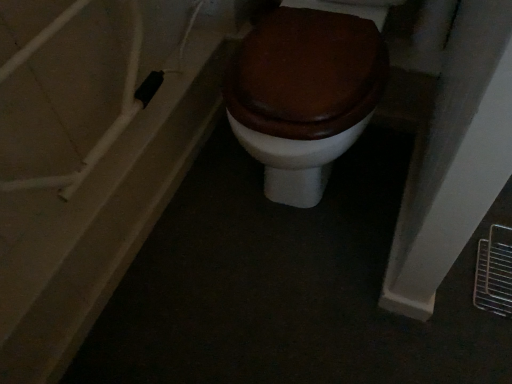
Identify the location of matte brown wood toilet at center. (304, 95).

What is the approximate width of matte brown wood toilet at center?

matte brown wood toilet at center is 73.54 centimeters in width.

The width and height of the screenshot is (512, 384). What do you see at coordinates (304, 95) in the screenshot?
I see `matte brown wood toilet at center` at bounding box center [304, 95].

In order to face matte brown wood toilet at center, should I rotate leftwards or rightwards?

It's best to rotate right around 7.763 degrees.

Find the location of a particular element. The width and height of the screenshot is (512, 384). matte white door at left is located at coordinates (92, 154).

The height and width of the screenshot is (384, 512). Describe the element at coordinates (92, 154) in the screenshot. I see `matte white door at left` at that location.

Find the location of a particular element. The image size is (512, 384). matte brown wood toilet at center is located at coordinates (304, 95).

Considering the positions of objects matte white door at left and matte brown wood toilet at center in the image provided, who is more to the right, matte white door at left or matte brown wood toilet at center?

matte brown wood toilet at center.

Which object is closer to the camera taking this photo, matte white door at left or matte brown wood toilet at center?

matte brown wood toilet at center is more forward.

Which point is more forward, [133,201] or [252,98]?

The point [252,98] is in front.

From the image's perspective, between matte white door at left and matte brown wood toilet at center, which one is located above?

matte brown wood toilet at center, from the image's perspective.

From a real-world perspective, is matte white door at left positioned under matte brown wood toilet at center based on gravity?

Yes, from a real-world perspective, matte white door at left is beneath matte brown wood toilet at center.

Can you confirm if matte white door at left is thinner than matte brown wood toilet at center?

No, matte white door at left is not thinner than matte brown wood toilet at center.

Is matte white door at left taller than matte brown wood toilet at center?

In fact, matte white door at left may be shorter than matte brown wood toilet at center.

Which of these two, matte white door at left or matte brown wood toilet at center, is smaller?

matte white door at left.

Is matte white door at left surrounding matte brown wood toilet at center?

Definitely not — matte brown wood toilet at center is not inside matte white door at left.

Are matte white door at left and matte brown wood toilet at center located far from each other?

No.

Is matte white door at left facing away from matte brown wood toilet at center?

That's not correct — matte white door at left is not looking away from matte brown wood toilet at center.

Can you tell me how much matte white door at left and matte brown wood toilet at center differ in facing direction?

The angular difference between matte white door at left and matte brown wood toilet at center is 180 degrees.

Image resolution: width=512 pixels, height=384 pixels. What are the coordinates of `toilet in front of the matte white door at left` in the screenshot? It's located at (304, 95).

Can you confirm if matte brown wood toilet at center is positioned to the right of matte white door at left?

Correct, you'll find matte brown wood toilet at center to the right of matte white door at left.

In the scene shown: Is matte brown wood toilet at center positioned behind matte white door at left?

No, it is not.

Does point (346, 82) come behind point (14, 80)?

Yes.

From the image's perspective, is matte brown wood toilet at center positioned above or below matte white door at left?

matte brown wood toilet at center is situated higher than matte white door at left in the image.

From a real-world perspective, is matte brown wood toilet at center located beneath matte white door at left?

No, from a real-world perspective, matte brown wood toilet at center is not under matte white door at left.

Which of these two, matte brown wood toilet at center or matte white door at left, is wider?

With larger width is matte white door at left.

Based on the photo, does matte brown wood toilet at center have a greater height compared to matte white door at left?

Correct, matte brown wood toilet at center is much taller as matte white door at left.

Which of these two, matte brown wood toilet at center or matte white door at left, is smaller?

With smaller size is matte white door at left.

Would you say matte white door at left is part of matte brown wood toilet at center's contents?

No, matte white door at left is not a part of matte brown wood toilet at center.

Based on the photo, are matte brown wood toilet at center and matte white door at left far apart?

matte brown wood toilet at center is actually quite close to matte white door at left.

Is matte brown wood toilet at center oriented towards matte white door at left?

No.

Identify the location of toilet that appears above the matte white door at left (from a real-world perspective). (304, 95).

Where is `bath below the matte brown wood toilet at center (from the image's perspective)`? bath below the matte brown wood toilet at center (from the image's perspective) is located at coordinates (92, 154).

Image resolution: width=512 pixels, height=384 pixels. I want to click on toilet in front of the matte white door at left, so click(304, 95).